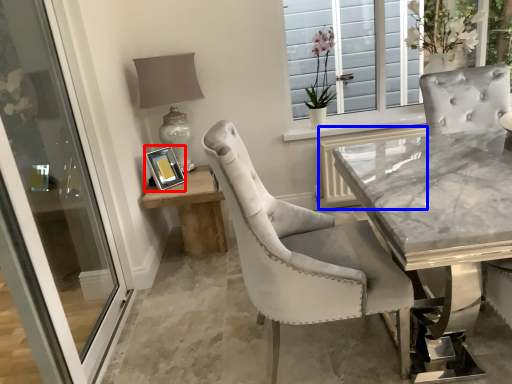
Question: Which point is closer to the camera, picture frame (highlighted by a red box) or shutter (highlighted by a blue box)?

Choices:
 (A) picture frame
 (B) shutter

Answer: (A)